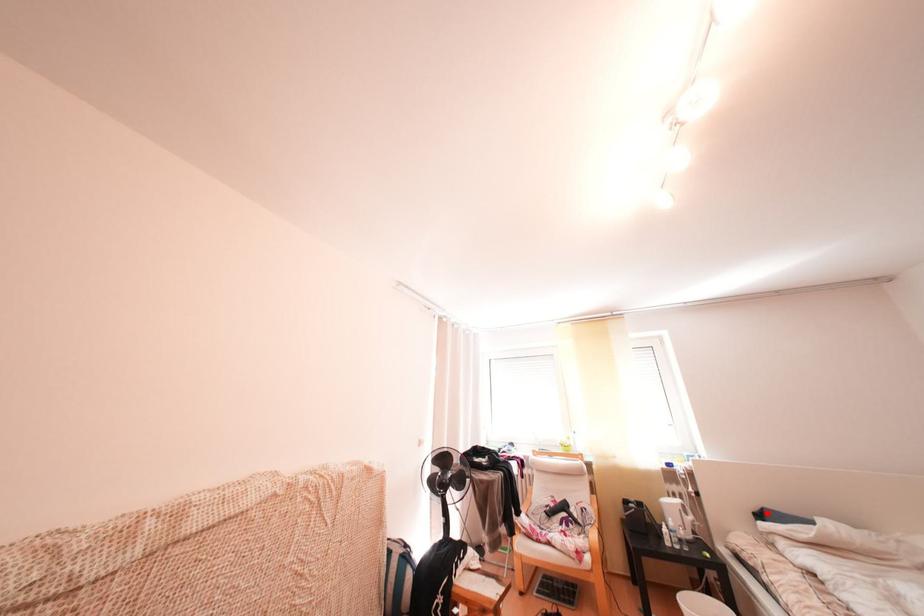
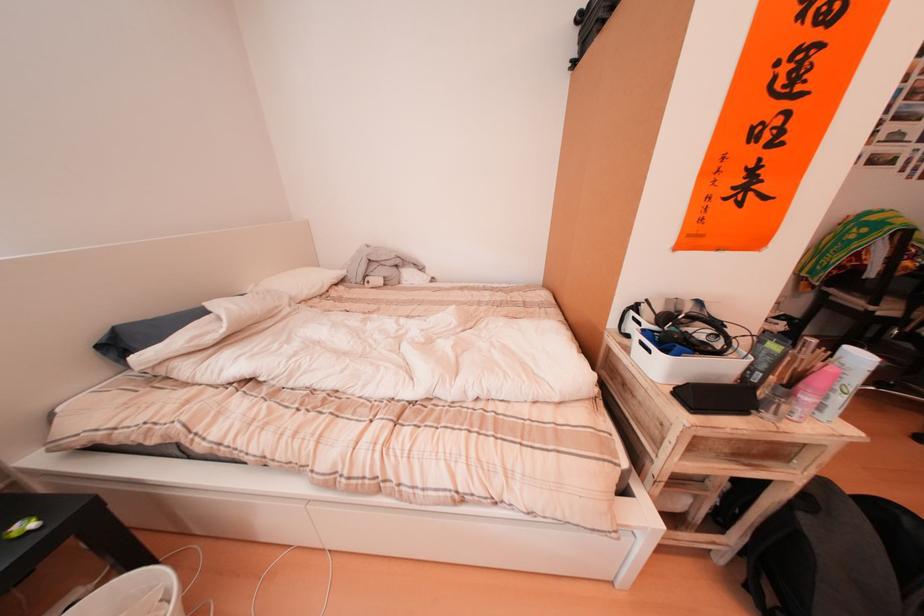
In the second image, find the point that corresponds to the highlighted location in the first image.

(105, 339)